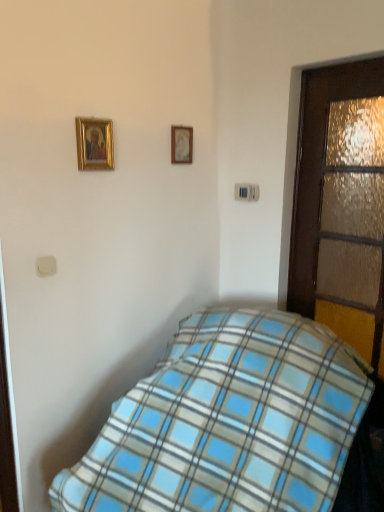
Question: Is wooden picture frame at upper center, which appears as the first picture frame when viewed from the right, outside of wooden textured door at right?

Choices:
 (A) yes
 (B) no

Answer: (A)

Question: Considering the relative sizes of wooden picture frame at upper center, which is counted as the 2th picture frame, starting from the front, and wooden textured door at right in the image provided, is wooden picture frame at upper center, which is counted as the 2th picture frame, starting from the front, wider than wooden textured door at right?

Choices:
 (A) no
 (B) yes

Answer: (A)

Question: Is wooden picture frame at upper center, which appears as the first picture frame when viewed from the right, oriented towards wooden textured door at right?

Choices:
 (A) no
 (B) yes

Answer: (A)

Question: Can you confirm if wooden picture frame at upper center, which appears as the first picture frame when viewed from the right, is bigger than wooden textured door at right?

Choices:
 (A) yes
 (B) no

Answer: (B)

Question: Is wooden picture frame at upper center, which appears as the 1th picture frame when viewed from the back, looking in the opposite direction of wooden textured door at right?

Choices:
 (A) no
 (B) yes

Answer: (A)

Question: Is wooden textured door at right inside or outside of wooden picture frame at upper center, which appears as the 1th picture frame when viewed from the back?

Choices:
 (A) outside
 (B) inside

Answer: (A)

Question: From their relative heights in the image, would you say wooden textured door at right is taller or shorter than wooden picture frame at upper center, marked as the second picture frame in a left-to-right arrangement?

Choices:
 (A) tall
 (B) short

Answer: (A)

Question: Does point (296, 183) appear closer or farther from the camera than point (182, 159)?

Choices:
 (A) farther
 (B) closer

Answer: (B)

Question: In the image, is wooden textured door at right on the left side or the right side of wooden picture frame at upper center, which is counted as the 2th picture frame, starting from the front?

Choices:
 (A) left
 (B) right

Answer: (B)

Question: From the image's perspective, is blue plaid blanket at lower center above or below wooden picture frame at upper center, which appears as the first picture frame when viewed from the right?

Choices:
 (A) above
 (B) below

Answer: (B)

Question: Is point (195, 465) positioned closer to the camera than point (173, 144)?

Choices:
 (A) farther
 (B) closer

Answer: (B)

Question: Is blue plaid blanket at lower center to the left or to the right of wooden picture frame at upper center, which appears as the first picture frame when viewed from the right, in the image?

Choices:
 (A) right
 (B) left

Answer: (A)

Question: Looking at the image, does blue plaid blanket at lower center seem bigger or smaller compared to wooden picture frame at upper center, which appears as the first picture frame when viewed from the right?

Choices:
 (A) small
 (B) big

Answer: (B)

Question: Is gold-framed picture at upper left, the 2th picture frame in the right-to-left sequence, to the left or to the right of wooden textured door at right in the image?

Choices:
 (A) right
 (B) left

Answer: (B)

Question: Considering the positions of gold-framed picture at upper left, the 2th picture frame in the right-to-left sequence, and wooden textured door at right in the image, is gold-framed picture at upper left, the 2th picture frame in the right-to-left sequence, taller or shorter than wooden textured door at right?

Choices:
 (A) short
 (B) tall

Answer: (A)